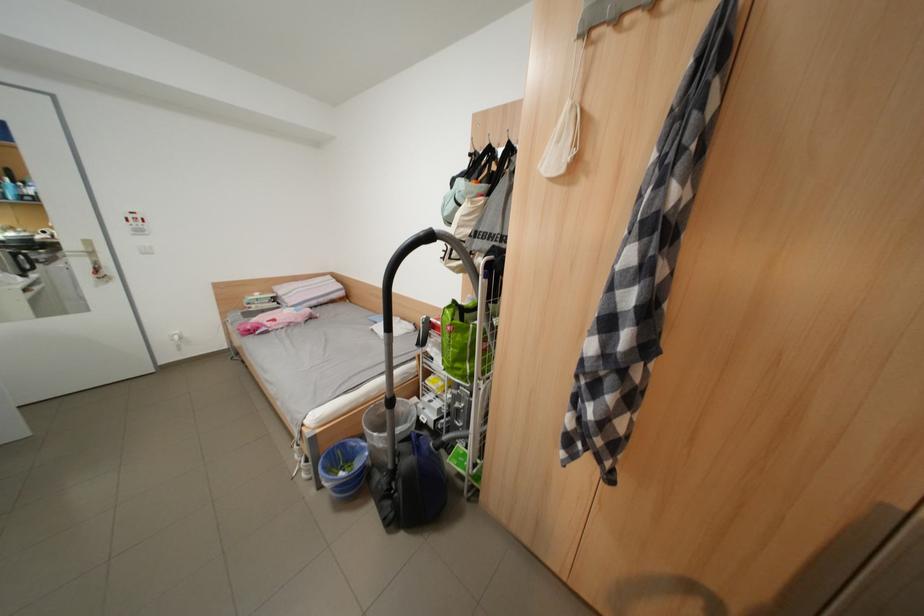
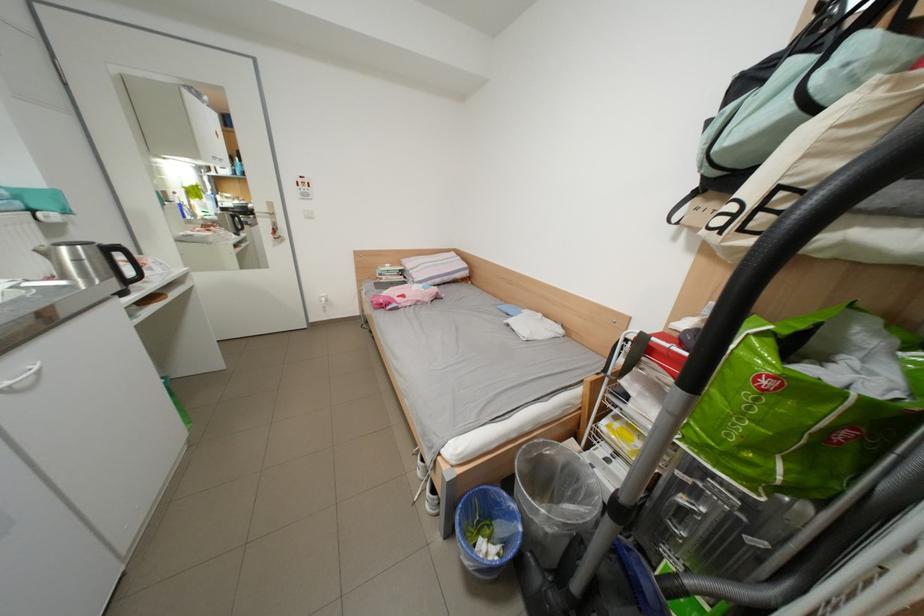
In the second image, find the point that corresponds to point (365, 448) in the first image.

(509, 506)